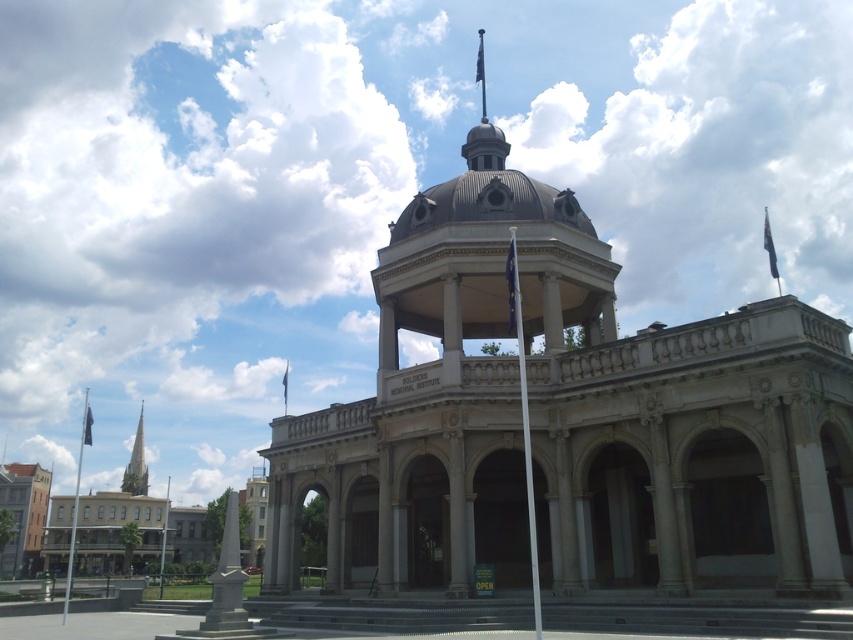
Question: Does gray stone building at center appear on the right side of black fabric flag at upper center?

Choices:
 (A) yes
 (B) no

Answer: (A)

Question: Which of these objects is positioned closest to the white flagpole at top?

Choices:
 (A) blue fabric flag at upper right
 (B) matte brick building at lower left

Answer: (A)

Question: Which point is closer to the camera?

Choices:
 (A) (505, 264)
 (B) (286, 360)

Answer: (A)

Question: Does white flagpole at top appear under blue fabric flag at upper right?

Choices:
 (A) yes
 (B) no

Answer: (B)

Question: Among these objects, which one is farthest from the camera?

Choices:
 (A) smooth gray steeple at left
 (B) blue fabric flag at upper right
 (C) black fabric flag at center

Answer: (A)

Question: Is gray stone building at center smaller than white metallic flagpole at center?

Choices:
 (A) yes
 (B) no

Answer: (B)